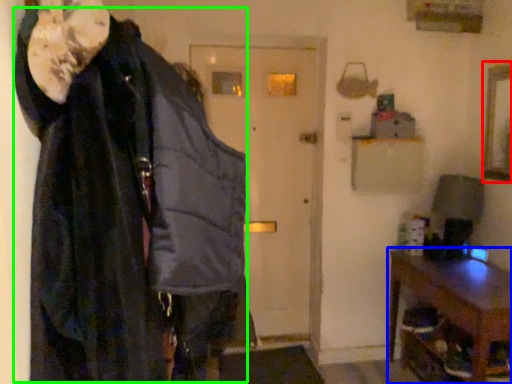
Question: Considering the real-world distances, which object is closest to picture frame (highlighted by a red box)? furniture (highlighted by a blue box) or cloak (highlighted by a green box).

Choices:
 (A) furniture
 (B) cloak

Answer: (A)